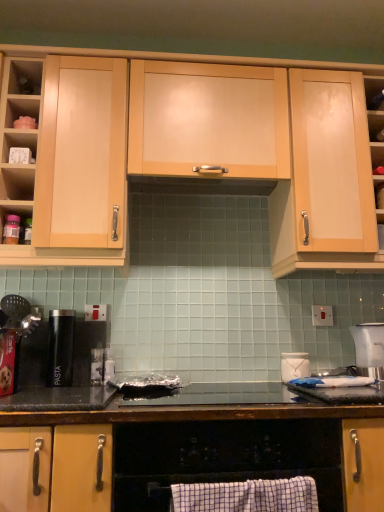
Question: Considering the relative sizes of wooden shelf at upper right, the 1th shelf positioned from the right, and black matte pasta canister at left in the image provided, is wooden shelf at upper right, the 1th shelf positioned from the right, shorter than black matte pasta canister at left?

Choices:
 (A) yes
 (B) no

Answer: (A)

Question: Could black matte pasta canister at left be considered to be inside wooden shelf at upper right, which is counted as the third shelf, starting from the left?

Choices:
 (A) no
 (B) yes

Answer: (A)

Question: From a real-world perspective, is wooden shelf at upper right, the 1th shelf positioned from the right, located beneath black matte pasta canister at left?

Choices:
 (A) yes
 (B) no

Answer: (B)

Question: Is wooden shelf at upper right, the 1th shelf positioned from the right, closer to the viewer compared to black matte pasta canister at left?

Choices:
 (A) no
 (B) yes

Answer: (A)

Question: Can you confirm if wooden shelf at upper right, the third shelf from the top, is bigger than black matte pasta canister at left?

Choices:
 (A) no
 (B) yes

Answer: (A)

Question: Does wooden shelf at upper right, which is counted as the first shelf, starting from the bottom, have a greater height compared to black matte pasta canister at left?

Choices:
 (A) no
 (B) yes

Answer: (A)

Question: From a real-world perspective, is matte plastic shelf at upper left, the 3th shelf in the right-to-left sequence, beneath white glossy jar at upper right?

Choices:
 (A) no
 (B) yes

Answer: (A)

Question: Considering the relative sizes of matte plastic shelf at upper left, the 3th shelf in the right-to-left sequence, and white glossy jar at upper right in the image provided, is matte plastic shelf at upper left, the 3th shelf in the right-to-left sequence, bigger than white glossy jar at upper right?

Choices:
 (A) yes
 (B) no

Answer: (B)

Question: Is matte plastic shelf at upper left, the 1th shelf positioned from the left, beside white glossy jar at upper right?

Choices:
 (A) no
 (B) yes

Answer: (A)

Question: From the image's perspective, does matte plastic shelf at upper left, the 3th shelf in the right-to-left sequence, appear higher than white glossy jar at upper right?

Choices:
 (A) no
 (B) yes

Answer: (B)

Question: Does matte plastic shelf at upper left, the 3th shelf positioned from the bottom, have a smaller size compared to white glossy jar at upper right?

Choices:
 (A) yes
 (B) no

Answer: (A)

Question: Can you confirm if matte plastic shelf at upper left, which is the 1th shelf in top-to-bottom order, is thinner than white glossy jar at upper right?

Choices:
 (A) no
 (B) yes

Answer: (A)

Question: Does white plastic clock at upper left, which appears as the 2th shelf when viewed from the top, have a lesser width compared to white plastic electric outlet at center right?

Choices:
 (A) no
 (B) yes

Answer: (A)